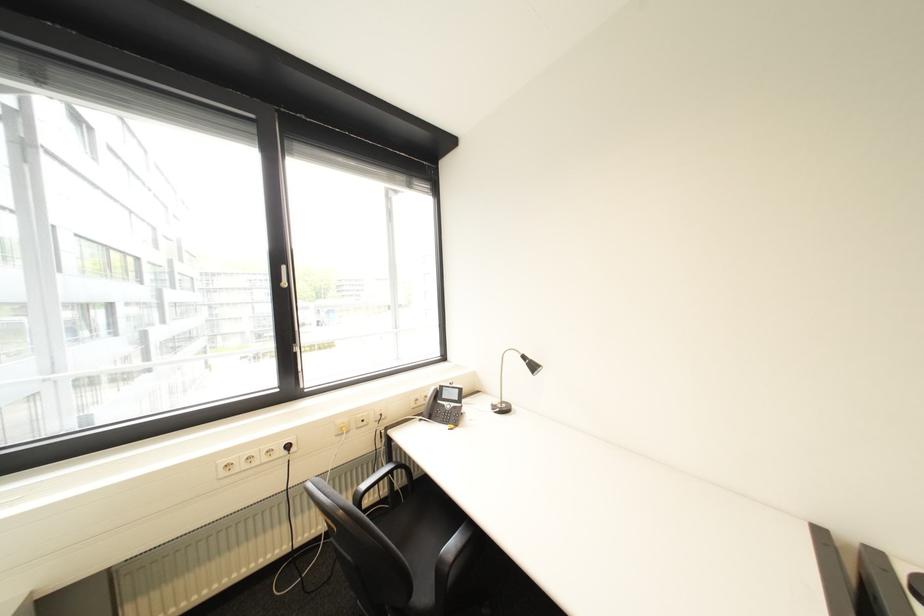
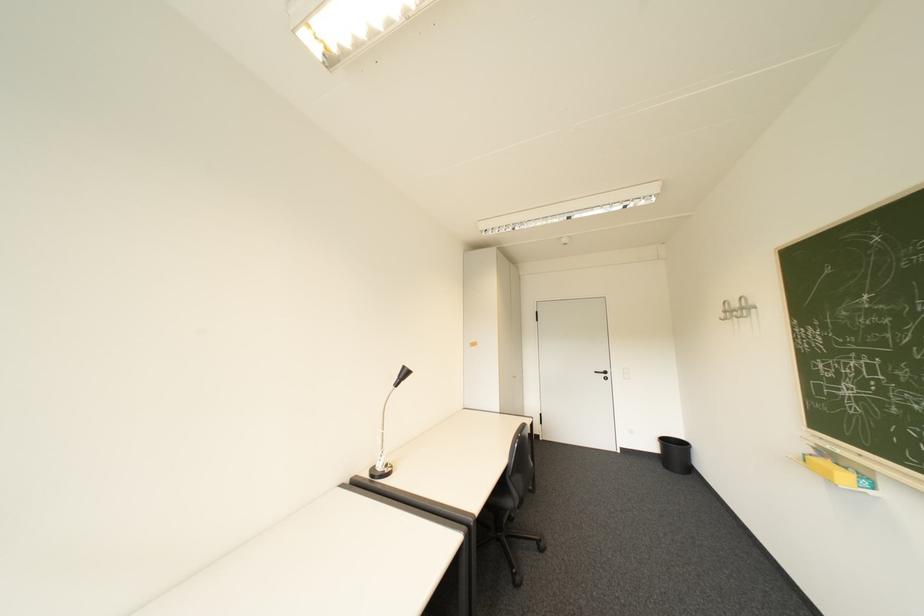
Question: The images are taken continuously from a first-person perspective. In which direction is your viewpoint rotating?

Choices:
 (A) Left
 (B) Right
 (C) Up
 (D) Down

Answer: (B)